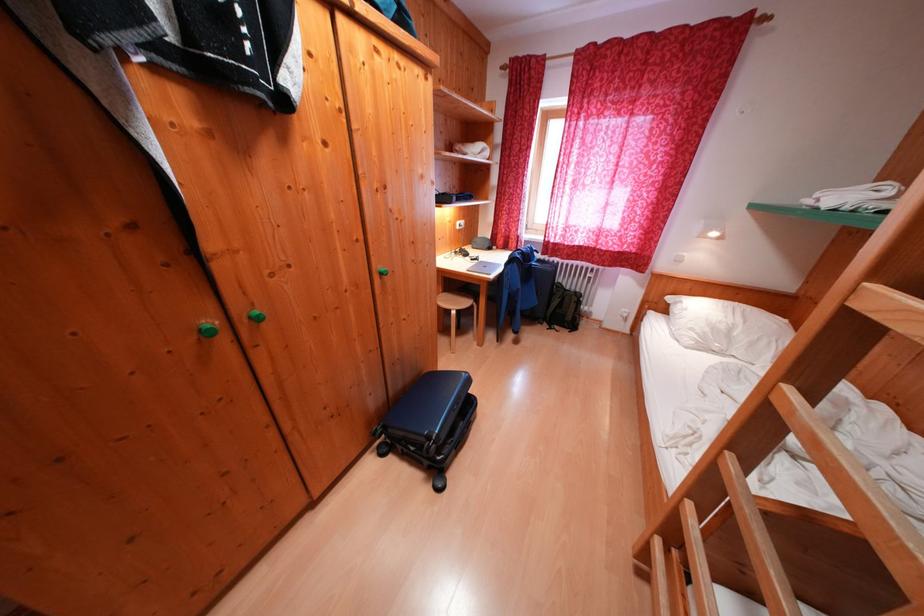
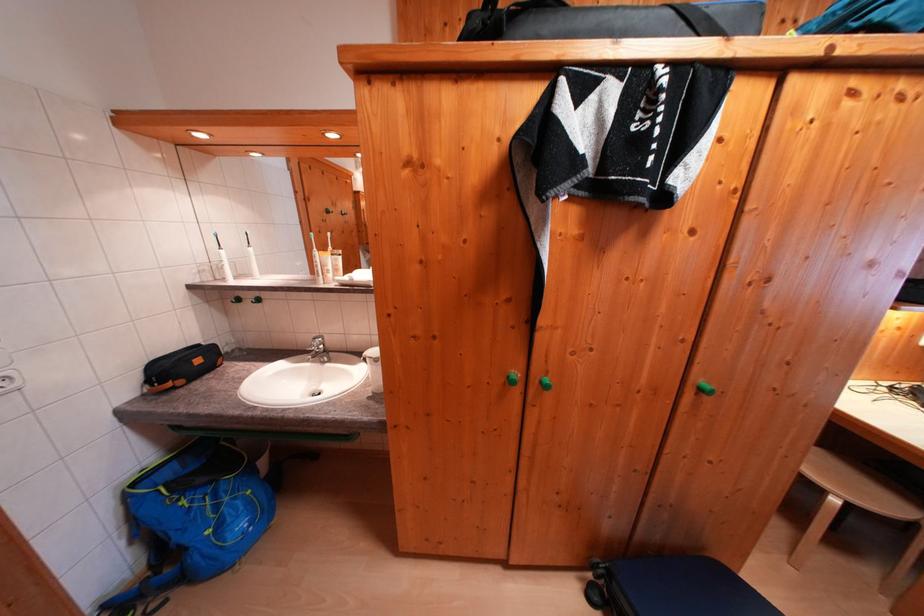
Locate, in the second image, the point that corresponds to pixel 462 315 in the first image.

(843, 505)